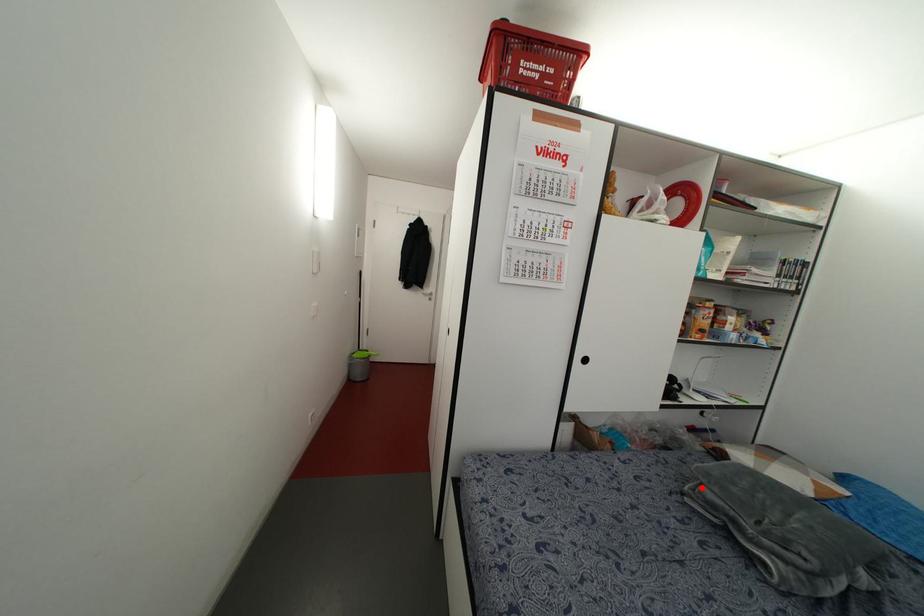
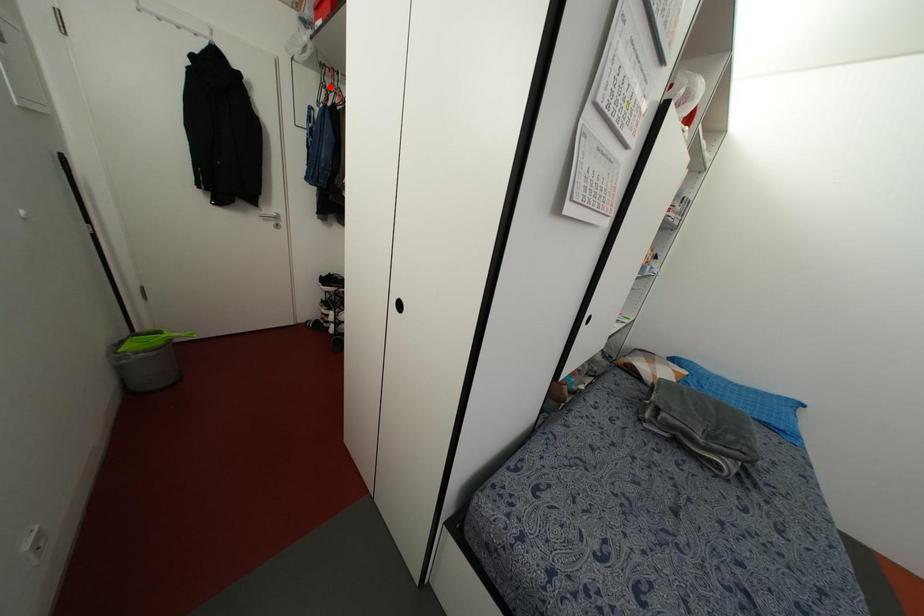
I am providing you with two images of the same scene from different viewpoints. A red point is marked on the first image and another point is marked on the second image. Does the point marked in image1 correspond to the same location as the one in image2?

No